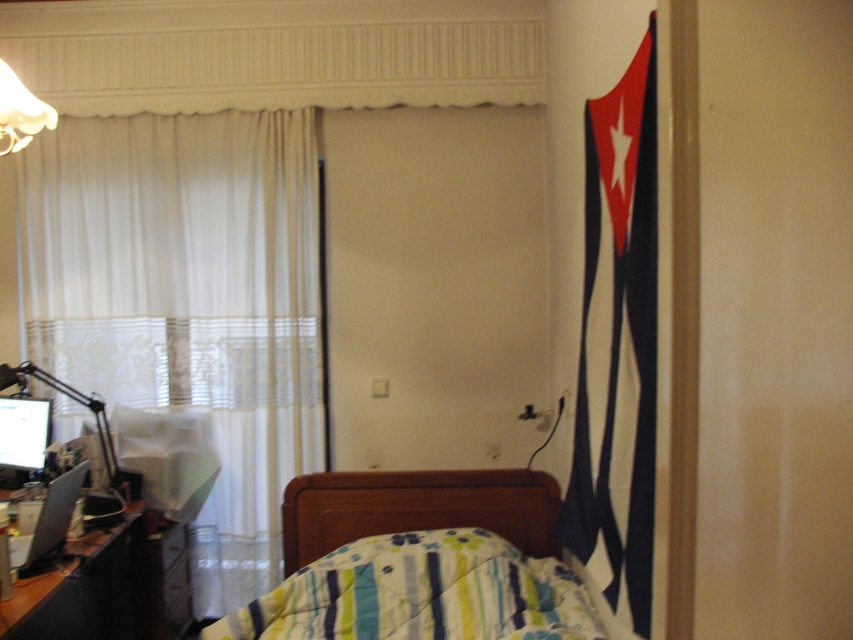
Between matte black monitor at left and matte black laptop at left, which one is positioned lower?

matte black laptop at left is below.

Between point (9, 484) and point (45, 524), which one is positioned in front?

Point (45, 524) is in front.

Does point (41, 468) come farther from viewer compared to point (45, 516)?

Yes, point (41, 468) is behind point (45, 516).

The height and width of the screenshot is (640, 853). In order to click on matte black monitor at left in this screenshot , I will do `click(21, 436)`.

Which is in front, point (102, 536) or point (51, 118)?

Point (51, 118) is more forward.

Can you confirm if wooden desk at lower left is shorter than white matte lampshade at upper left?

In fact, wooden desk at lower left may be taller than white matte lampshade at upper left.

Is point (119, 600) positioned in front of point (27, 100)?

No, (119, 600) is further to viewer.

At what (x,y) coordinates should I click in order to perform the action: click on wooden desk at lower left. Please return your answer as a coordinate pair (x, y). Looking at the image, I should click on (77, 589).

Is wooden desk at lower left to the left of matte black monitor at left from the viewer's perspective?

In fact, wooden desk at lower left is to the right of matte black monitor at left.

What do you see at coordinates (77, 589) in the screenshot? This screenshot has width=853, height=640. I see `wooden desk at lower left` at bounding box center [77, 589].

Describe the element at coordinates (77, 589) in the screenshot. I see `wooden desk at lower left` at that location.

Locate an element on the screen. The image size is (853, 640). wooden desk at lower left is located at coordinates (77, 589).